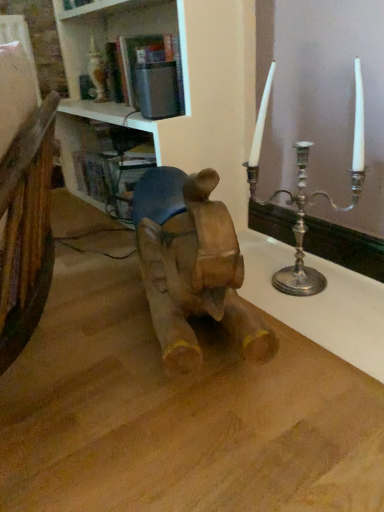
Identify the location of wooden horse at center. This screenshot has width=384, height=512. (192, 266).

This screenshot has height=512, width=384. What do you see at coordinates (325, 118) in the screenshot?
I see `silver metallic candlestick at upper right` at bounding box center [325, 118].

Locate an element on the screen. silver metallic candlestick at upper right is located at coordinates (325, 118).

This screenshot has height=512, width=384. I want to click on silver metallic candle holder at right, so click(x=304, y=220).

From a real-world perspective, is silver metallic candle holder at right physically below silver metallic candlestick at upper right?

Yes, from a real-world perspective, silver metallic candle holder at right is below silver metallic candlestick at upper right.

Which object is wider, silver metallic candle holder at right or silver metallic candlestick at upper right?

Wider between the two is silver metallic candlestick at upper right.

Is there a large distance between silver metallic candle holder at right and silver metallic candlestick at upper right?

No, silver metallic candle holder at right is not far away from silver metallic candlestick at upper right.

Consider the image. What's the angular difference between silver metallic candle holder at right and silver metallic candlestick at upper right's facing directions?

The angular difference between silver metallic candle holder at right and silver metallic candlestick at upper right is 0.286 degrees.

In the scene shown: Considering the sizes of objects silver metallic candle holder at right and wooden horse at center in the image provided, who is taller, silver metallic candle holder at right or wooden horse at center?

wooden horse at center is taller.

Considering the points (297, 218) and (148, 223), which point is in front, point (297, 218) or point (148, 223)?

Point (148, 223)

Looking at this image, how many degrees apart are the facing directions of silver metallic candle holder at right and wooden horse at center?

19.2 degrees.

Looking at their sizes, would you say silver metallic candle holder at right is wider or thinner than wooden horse at center?

Considering their sizes, silver metallic candle holder at right looks slimmer than wooden horse at center.

Does wooden horse at center appear on the left side of silver metallic candlestick at upper right?

Yes.

This screenshot has height=512, width=384. What are the coordinates of `animal lying on the left of silver metallic candlestick at upper right` in the screenshot? It's located at (192, 266).

Which of these two, wooden horse at center or silver metallic candlestick at upper right, stands taller?

silver metallic candlestick at upper right is taller.

Is wooden horse at center in contact with silver metallic candlestick at upper right?

No, wooden horse at center is not touching silver metallic candlestick at upper right.

Is the position of white glossy bookshelf at upper center less distant than that of silver metallic candle holder at right?

Yes, white glossy bookshelf at upper center is in front of silver metallic candle holder at right.

Is white glossy bookshelf at upper center positioned with its back to silver metallic candle holder at right?

No, white glossy bookshelf at upper center is not facing away from silver metallic candle holder at right.

Is white glossy bookshelf at upper center at the right side of silver metallic candle holder at right?

No.

From the image's perspective, is white glossy bookshelf at upper center located above silver metallic candle holder at right?

Yes.

Do you think wooden horse at center is within silver metallic candle holder at right, or outside of it?

wooden horse at center is located beyond the bounds of silver metallic candle holder at right.

Which is behind, point (162, 234) or point (287, 276)?

The point (287, 276) is farther.

This screenshot has height=512, width=384. In order to click on animal on the left of silver metallic candle holder at right in this screenshot , I will do `click(192, 266)`.

Is the surface of wooden horse at center in direct contact with silver metallic candle holder at right?

wooden horse at center and silver metallic candle holder at right are not in contact.

Does wooden horse at center turn towards white glossy bookshelf at upper center?

No, wooden horse at center is not aimed at white glossy bookshelf at upper center.

Is wooden horse at center beside white glossy bookshelf at upper center?

No.

Does wooden horse at center lie behind white glossy bookshelf at upper center?

No.

How much distance is there between wooden horse at center and white glossy bookshelf at upper center?

wooden horse at center and white glossy bookshelf at upper center are 3.60 feet apart.

Can you confirm if white glossy bookshelf at upper center is thinner than wooden horse at center?

No, white glossy bookshelf at upper center is not thinner than wooden horse at center.

Is white glossy bookshelf at upper center located outside wooden horse at center?

white glossy bookshelf at upper center lies outside wooden horse at center's area.

From the image's perspective, relative to wooden horse at center, is white glossy bookshelf at upper center above or below?

From the image's perspective, white glossy bookshelf at upper center appears above wooden horse at center.

From a real-world perspective, between white glossy bookshelf at upper center and wooden horse at center, who is vertically lower?

wooden horse at center.

You are a GUI agent. You are given a task and a screenshot of the screen. Output one action in this format:
    pyautogui.click(x=<x>, y=<y>)
    Task: Click on the candle holder below the silver metallic candlestick at upper right (from the image's perspective)
    The width and height of the screenshot is (384, 512).
    Given the screenshot: What is the action you would take?
    pyautogui.click(x=304, y=220)

Where is `animal positioned vertically above the silver metallic candle holder at right (from a real-world perspective)`? animal positioned vertically above the silver metallic candle holder at right (from a real-world perspective) is located at coordinates (192, 266).

Estimate the real-world distances between objects in this image. Which object is further from silver metallic candlestick at upper right, silver metallic candle holder at right or wooden horse at center?

Among the two, wooden horse at center is located further to silver metallic candlestick at upper right.

Which object lies nearer to the anchor point silver metallic candlestick at upper right, silver metallic candle holder at right or white glossy bookshelf at upper center?

silver metallic candle holder at right lies closer to silver metallic candlestick at upper right than the other object.

Estimate the real-world distances between objects in this image. Which object is further from wooden horse at center, white glossy bookshelf at upper center or silver metallic candlestick at upper right?

Among the two, white glossy bookshelf at upper center is located further to wooden horse at center.

Looking at the image, which one is located further to silver metallic candlestick at upper right, white glossy bookshelf at upper center or silver metallic candle holder at right?

white glossy bookshelf at upper center lies further to silver metallic candlestick at upper right than the other object.

From the picture: When comparing their distances from wooden horse at center, does silver metallic candlestick at upper right or white glossy bookshelf at upper center seem further?

The object further to wooden horse at center is white glossy bookshelf at upper center.

When comparing their distances from silver metallic candle holder at right, does silver metallic candlestick at upper right or wooden horse at center seem further?

wooden horse at center lies further to silver metallic candle holder at right than the other object.

From the image, which object appears to be farther from silver metallic candlestick at upper right, white glossy bookshelf at upper center or wooden horse at center?

white glossy bookshelf at upper center lies further to silver metallic candlestick at upper right than the other object.

Which object lies further to the anchor point silver metallic candlestick at upper right, wooden horse at center or silver metallic candle holder at right?

wooden horse at center is positioned further to the anchor silver metallic candlestick at upper right.

I want to click on window frame between white glossy bookshelf at upper center and wooden horse at center vertically, so click(x=325, y=118).

You are a GUI agent. You are given a task and a screenshot of the screen. Output one action in this format:
    pyautogui.click(x=<x>, y=<y>)
    Task: Click on the window frame between white glossy bookshelf at upper center and silver metallic candle holder at right from left to right
    Image resolution: width=384 pixels, height=512 pixels.
    Given the screenshot: What is the action you would take?
    pyautogui.click(x=325, y=118)

In order to click on animal between white glossy bookshelf at upper center and silver metallic candle holder at right from left to right in this screenshot , I will do `click(192, 266)`.

Find the location of `window frame positioned between wooden horse at center and silver metallic candle holder at right from near to far`. window frame positioned between wooden horse at center and silver metallic candle holder at right from near to far is located at coordinates (325, 118).